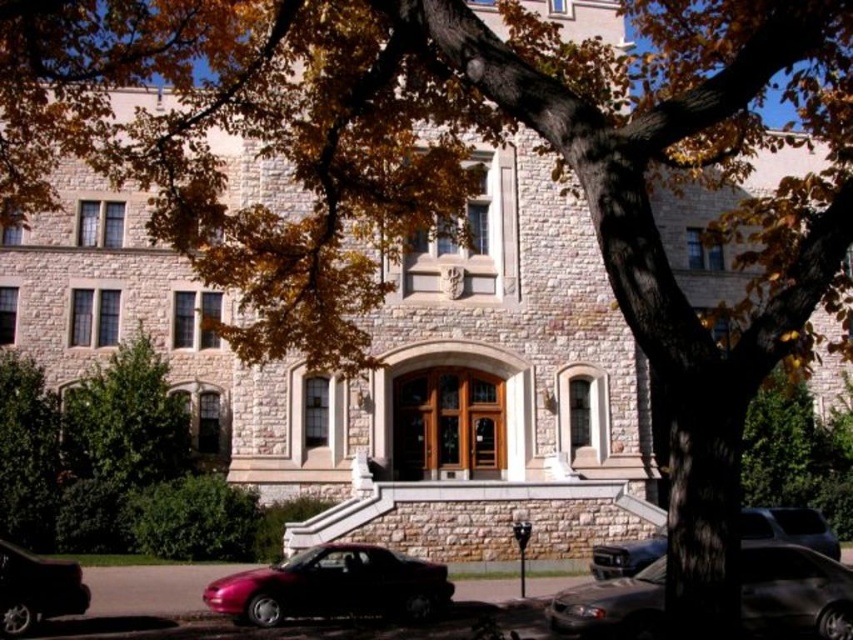
Is shiny red car at lower left thinner than shiny black car at lower left?

No, shiny red car at lower left is not thinner than shiny black car at lower left.

Does shiny red car at lower left have a greater width compared to shiny black car at lower left?

Yes, shiny red car at lower left is wider than shiny black car at lower left.

Is point (338, 602) farther from camera compared to point (3, 608)?

That is True.

Where is `shiny red car at lower left`? This screenshot has height=640, width=853. shiny red car at lower left is located at coordinates (334, 586).

Who is lower down, shiny black car at lower left or metallic silver sedan at lower right?

shiny black car at lower left is below.

Does shiny black car at lower left lie in front of metallic silver sedan at lower right?

No, shiny black car at lower left is behind metallic silver sedan at lower right.

Locate an element on the screen. shiny black car at lower left is located at coordinates [36, 589].

Between shiny red car at lower left and metallic silver sedan at lower right, which one appears on the right side from the viewer's perspective?

From the viewer's perspective, metallic silver sedan at lower right appears more on the right side.

Can you confirm if shiny red car at lower left is positioned below metallic silver sedan at lower right?

Incorrect, shiny red car at lower left is not positioned below metallic silver sedan at lower right.

Where is `shiny red car at lower left`? This screenshot has height=640, width=853. shiny red car at lower left is located at coordinates (334, 586).

Image resolution: width=853 pixels, height=640 pixels. Find the location of `shiny red car at lower left`. shiny red car at lower left is located at coordinates (334, 586).